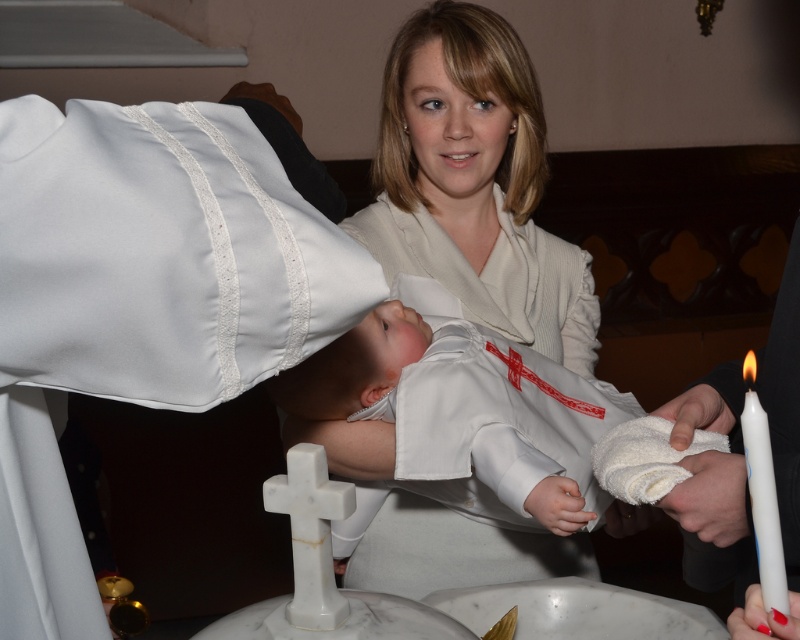
Question: Based on their relative distances, which object is farther from the smooth white candle at lower right?

Choices:
 (A) white satin baby at center
 (B) white soft towel at lower right
 (C) white smooth skin at center

Answer: (A)

Question: Which object is positioned closest to the white smooth skin at center?

Choices:
 (A) smooth white candle at lower right
 (B) white matte candle at right
 (C) white satin baby at center

Answer: (C)

Question: Among these objects, which one is farthest from the camera?

Choices:
 (A) smooth white candle at lower right
 (B) white smooth skin at center
 (C) white soft towel at lower right
 (D) white satin baby at center

Answer: (D)

Question: Can you confirm if white satin robe at center is wider than white smooth towel at lower right?

Choices:
 (A) no
 (B) yes

Answer: (B)

Question: Does white soft towel at lower right have a larger size compared to smooth white candle at lower right?

Choices:
 (A) no
 (B) yes

Answer: (B)

Question: Can you confirm if white smooth skin at center is positioned to the right of smooth white candle at lower right?

Choices:
 (A) yes
 (B) no

Answer: (B)